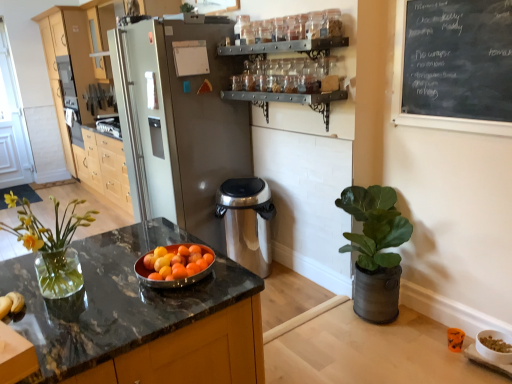
At what (x,y) coordinates should I click in order to perform the action: click on empty space that is ontop of black marble countertop at center (from a real-world perspective). Please return your answer as a coordinate pair (x, y). This screenshot has width=512, height=384. Looking at the image, I should click on (100, 276).